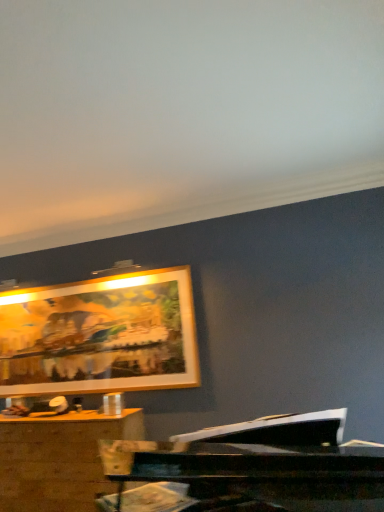
Image resolution: width=384 pixels, height=512 pixels. What are the coordinates of `empty space that is ontop of gold-framed artwork at upper center` in the screenshot? It's located at (87, 280).